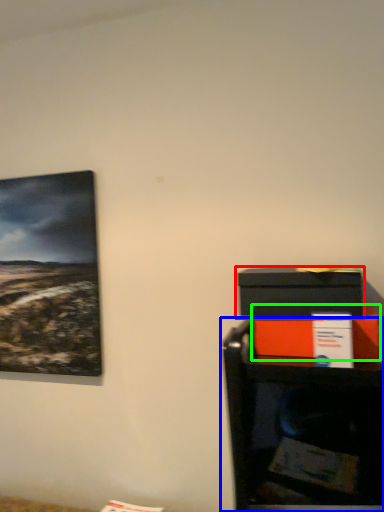
Question: Based on their relative distances, which object is farther from box (highlighted by a red box)? Choose from furniture (highlighted by a blue box) and box (highlighted by a green box).

Choices:
 (A) furniture
 (B) box

Answer: (A)